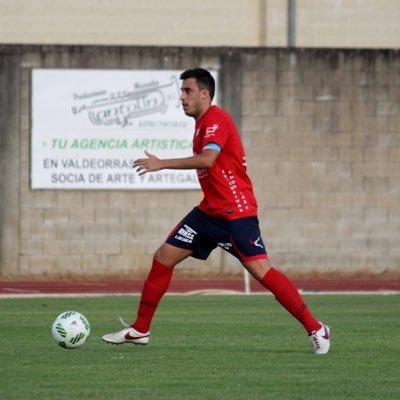
At what (x,y) coordinates should I click in order to perform the action: click on brick wall. Please return your answer as a coordinate pair (x, y). This screenshot has height=400, width=400. Looking at the image, I should click on (329, 181), (344, 84), (293, 124), (90, 234), (14, 106), (24, 246).